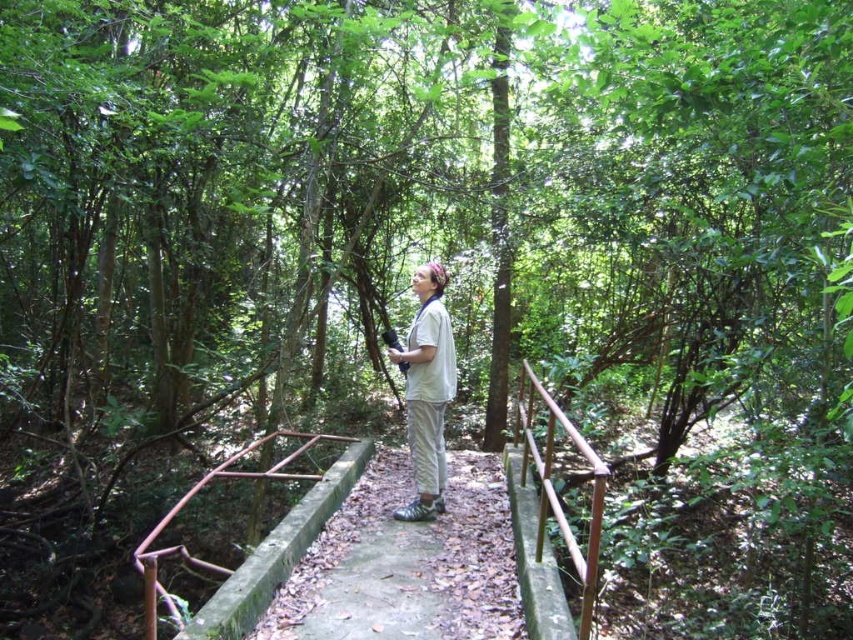
Which is above, concrete at center or rusty metal rail at center?

Positioned higher is rusty metal rail at center.

This screenshot has width=853, height=640. What do you see at coordinates (405, 563) in the screenshot?
I see `concrete at center` at bounding box center [405, 563].

Describe the element at coordinates (405, 563) in the screenshot. I see `concrete at center` at that location.

Where is `concrete at center`? This screenshot has width=853, height=640. concrete at center is located at coordinates (405, 563).

Measure the distance from rusty metal rail at center to white cotton shirt at center.

rusty metal rail at center and white cotton shirt at center are 1.82 meters apart.

Between rusty metal rail at center and white cotton shirt at center, which one appears on the left side from the viewer's perspective?

rusty metal rail at center is more to the left.

Does point (294, 435) lie behind point (418, 426)?

Yes, point (294, 435) is farther from viewer.

Find the location of a particular element. The image size is (853, 640). rusty metal rail at center is located at coordinates (254, 547).

Who is positioned more to the right, concrete at center or brown wooden rail at center?

From the viewer's perspective, brown wooden rail at center appears more on the right side.

Is the position of concrete at center less distant than that of brown wooden rail at center?

Yes, concrete at center is closer to the viewer.

Image resolution: width=853 pixels, height=640 pixels. Describe the element at coordinates (405, 563) in the screenshot. I see `concrete at center` at that location.

Identify the location of concrete at center. (405, 563).